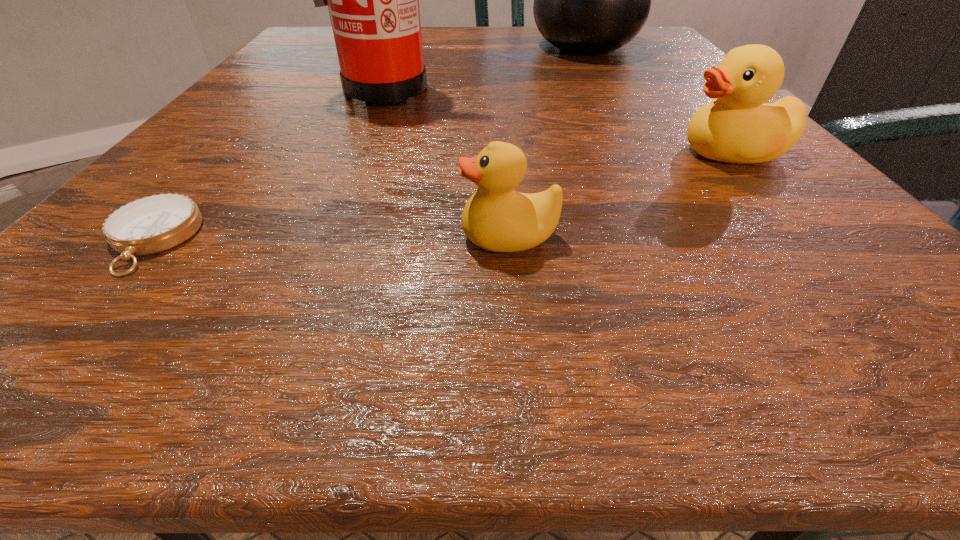
Image resolution: width=960 pixels, height=540 pixels. I want to click on the tallest object, so click(x=373, y=0).

Find the location of a particular element. the fourth nearest object is located at coordinates (373, 0).

This screenshot has width=960, height=540. I want to click on vase, so click(x=590, y=0).

You are a GUI agent. You are given a task and a screenshot of the screen. Output one action in this format:
    pyautogui.click(x=<x>, y=<y>)
    Task: Click on the farthest object
    This screenshot has width=960, height=540.
    Given the screenshot: What is the action you would take?
    pyautogui.click(x=590, y=0)

You are a GUI agent. You are given a task and a screenshot of the screen. Output one action in this format:
    pyautogui.click(x=<x>, y=<y>)
    Task: Click on the third farthest object
    The image size is (960, 540).
    Given the screenshot: What is the action you would take?
    pyautogui.click(x=738, y=127)

Image resolution: width=960 pixels, height=540 pixels. I want to click on the third tallest object, so click(x=738, y=127).

Find the location of a particular element. The width and height of the screenshot is (960, 540). the left duck is located at coordinates (497, 218).

This screenshot has height=540, width=960. In order to click on the nearer duck in this screenshot , I will do `click(497, 218)`.

Identify the location of compass. This screenshot has width=960, height=540. (152, 224).

This screenshot has width=960, height=540. Find the location of `the leftmost object`. the leftmost object is located at coordinates (152, 224).